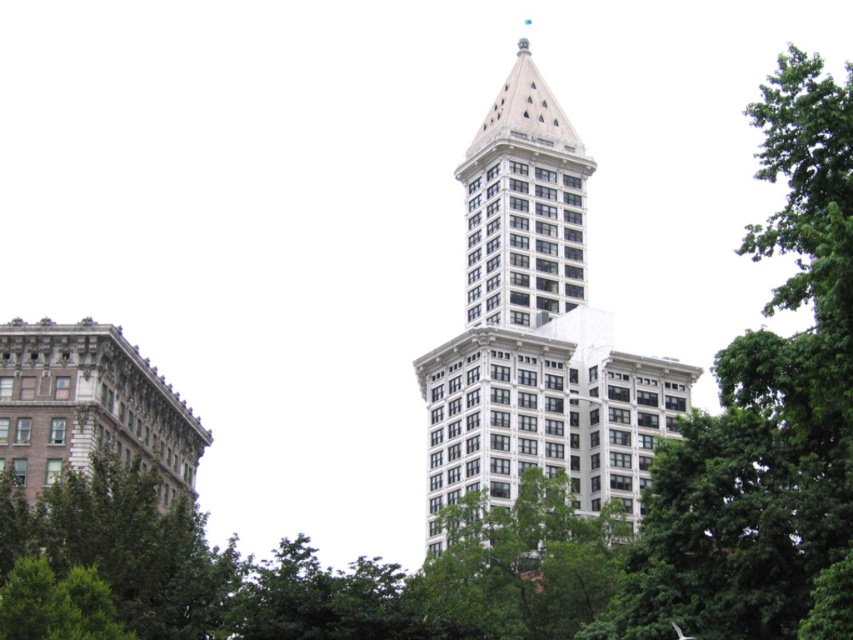
Identify the location of green leafy tree at upper right. (766, 417).

Between green leafy tree at upper right and white stone building at center, which one appears on the right side from the viewer's perspective?

Positioned to the right is green leafy tree at upper right.

The height and width of the screenshot is (640, 853). What do you see at coordinates (766, 417) in the screenshot?
I see `green leafy tree at upper right` at bounding box center [766, 417].

This screenshot has width=853, height=640. Find the location of `green leafy tree at upper right`. green leafy tree at upper right is located at coordinates (766, 417).